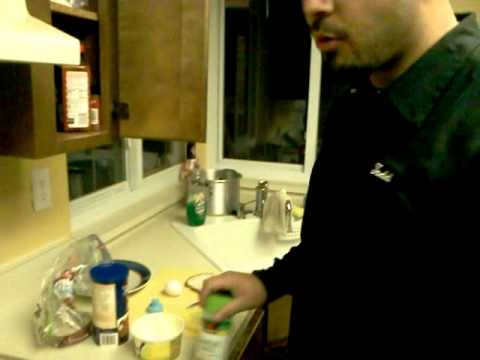
Where is `cutting board`? The image size is (480, 360). cutting board is located at coordinates (178, 302).